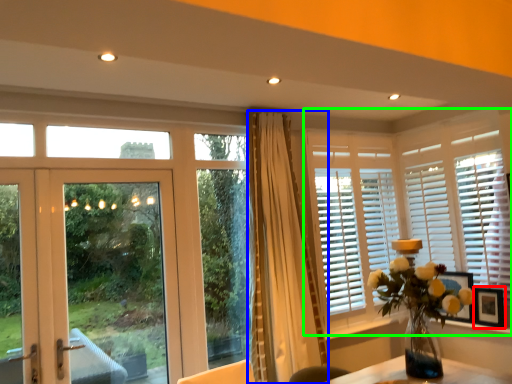
Question: Which object is positioned farthest from picture frame (highlighted by a red box)? Select from curtain (highlighted by a blue box) and window (highlighted by a green box).

Choices:
 (A) curtain
 (B) window

Answer: (A)